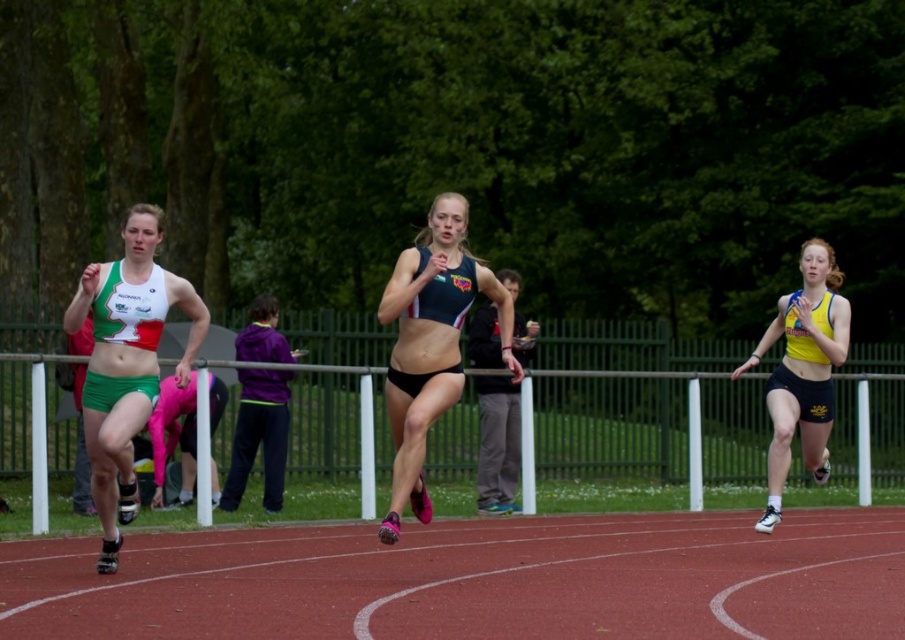
You are a photographer positioned at the starting line of the sprint race. You want to take a photo of the two points mentioned in the image. Which point, point (183, 289) or point (830, 401), will appear larger in your photo?

Point (183, 289) will appear larger in the photo because it is closer to the viewer than point (830, 401).

You are a photographer standing behind the runners. You want to take a photo that includes both the matte green shorts at left and the white plastic rail at center. Given that your camera has a maximum focus range of 15 feet, will you be able to capture both objects in focus?

The matte green shorts at left is 16.10 feet from the white plastic rail at center. Since the distance between them exceeds the camera maximum focus range of 15 feet, you cannot capture both objects in focus.

You are a photographer standing at the camera position. You want to capture a closeup shot of the matte green shorts at left. Given that your camera has a maximum zoom range of 10 meters, will you be able to focus on the shorts?

The matte green shorts at left and camera are 10.10 meters apart from each other. Since the camera can only zoom up to 10 meters, the distance is slightly beyond its capability, so you won t be able to focus on the shorts.